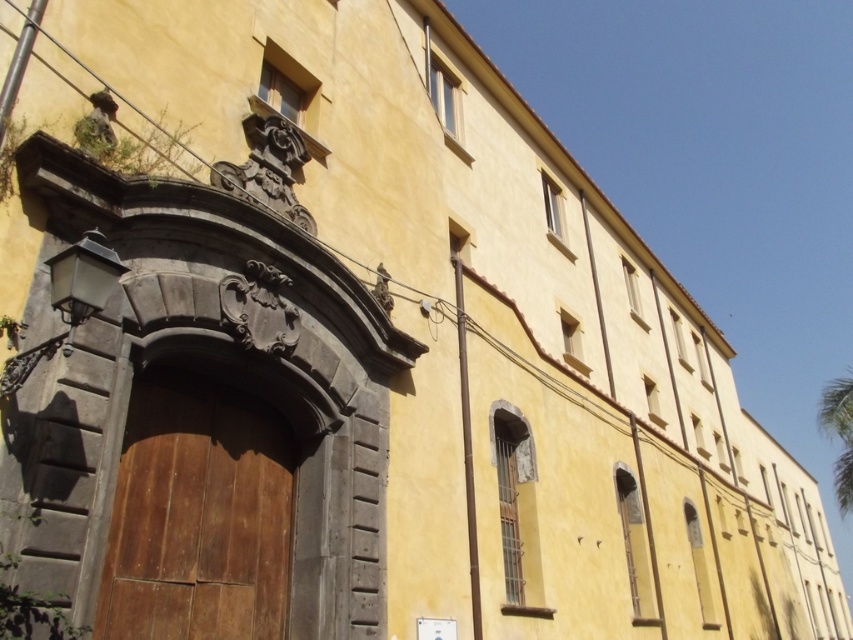
You are standing in front of the yellowish building with the wooden door at center and the green leafy palm tree at upper right. Which object is positioned to the left of the other?

The wooden door at center is to the left of green leafy palm tree at upper right.

You are a painter standing at the base of the building. You want to paint the wooden door at center and the green leafy palm tree at upper right. Which object will require more paint due to its larger size?

The green leafy palm tree at upper right will require more paint because it is larger in size than the wooden door at center.